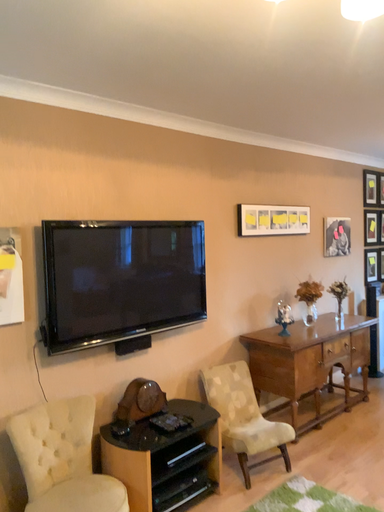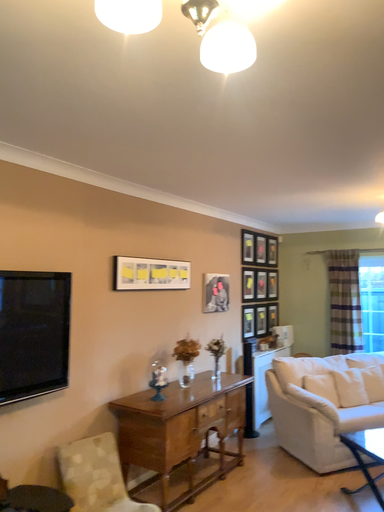
Question: How did the camera likely rotate when shooting the video?

Choices:
 (A) rotated downward
 (B) rotated upward

Answer: (B)